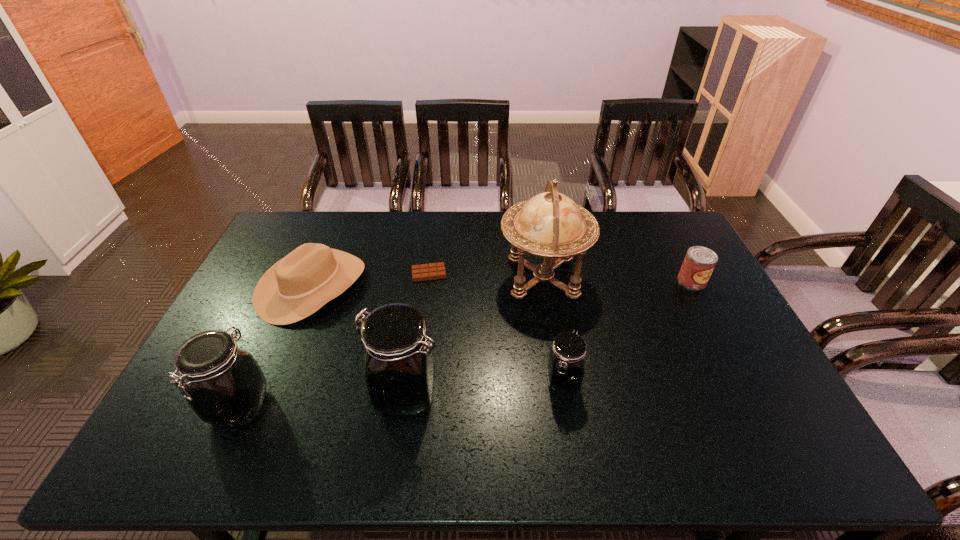
Please point out where to position a new jar on the right to maintain spacing. Please provide its 2D coordinates. Your answer should be formatted as a tuple, i.e. [(x, y)], where the tuple contains the x and y coordinates of a point satisfying the conditions above.

[(712, 368)]